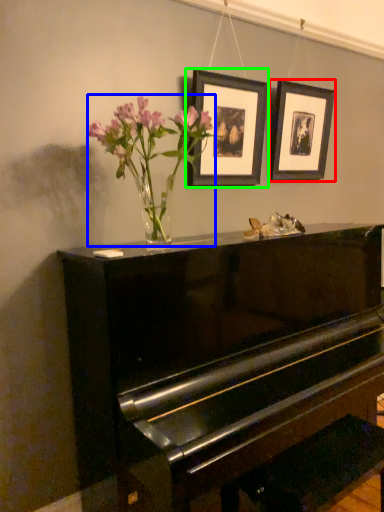
Question: Estimate the real-world distances between objects in this image. Which object is farther from picture frame (highlighted by a red box), floral arrangement (highlighted by a blue box) or picture frame (highlighted by a green box)?

Choices:
 (A) floral arrangement
 (B) picture frame

Answer: (A)